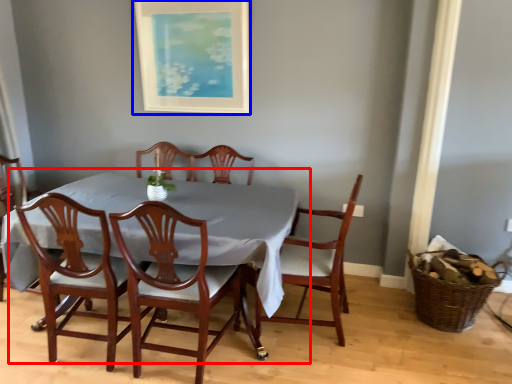
Question: Among these objects, which one is farthest to the camera, kitchen & dining room table (highlighted by a red box) or picture frame (highlighted by a blue box)?

Choices:
 (A) kitchen & dining room table
 (B) picture frame

Answer: (B)